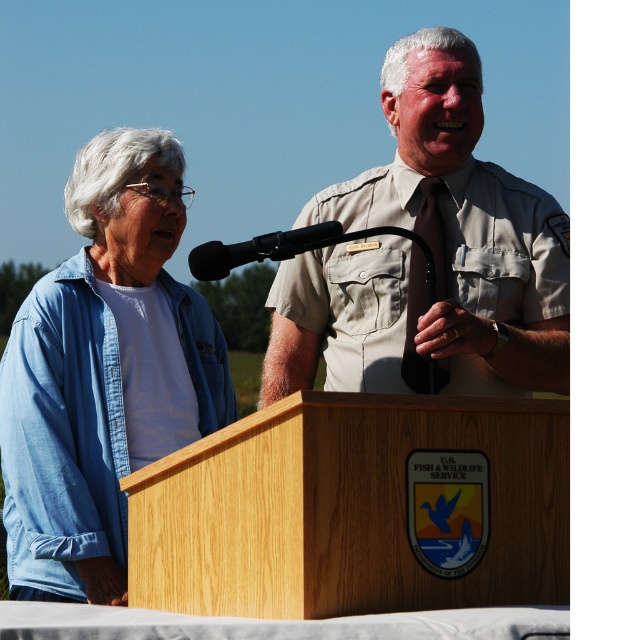
You are a photographer at the event and need to capture a photo of the denim shirt at left and the black matte microphone at center. Which object is positioned to the left of the other?

The denim shirt at left is to the left of the black matte microphone at center according to the description provided.

You are organizing a photo shoot and need to ensure that the khaki uniform at center and the denim shirt at left are visible in the frame. Given their height difference, which clothing item might require adjusting the camera angle to capture properly?

The khaki uniform at center is much taller than the denim shirt at left, so adjusting the camera angle to account for its greater height would help ensure both are visible in the frame.